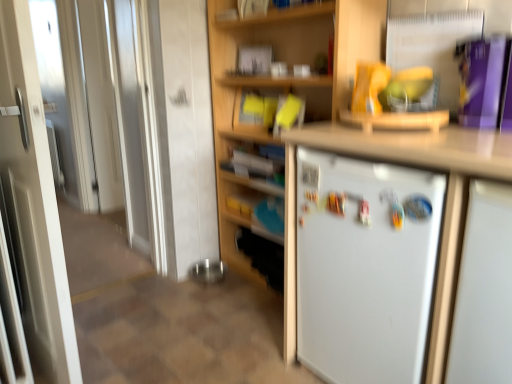
The height and width of the screenshot is (384, 512). I want to click on free space above beige tile at lower center (from a real-world perspective), so click(181, 331).